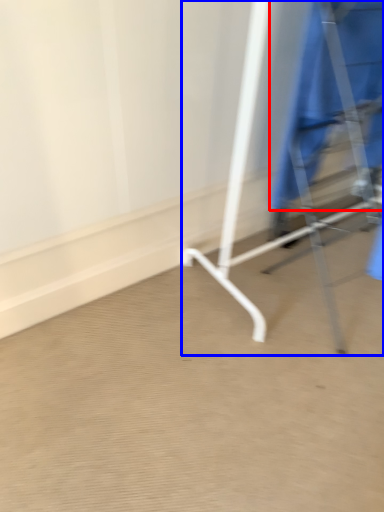
Question: Which of the following is the farthest to the observer, robe (highlighted by a red box) or furniture (highlighted by a blue box)?

Choices:
 (A) robe
 (B) furniture

Answer: (A)